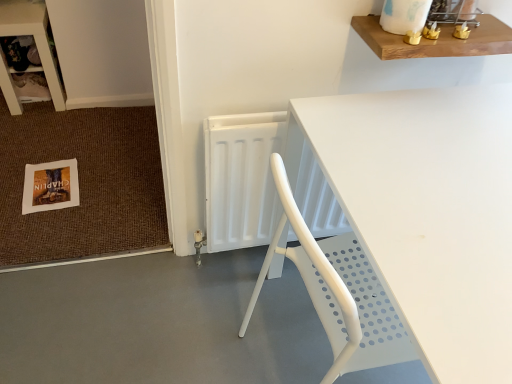
This screenshot has height=384, width=512. In order to click on free spot above wooden shelf at upper right (from a real-world perspective) in this screenshot , I will do `click(429, 23)`.